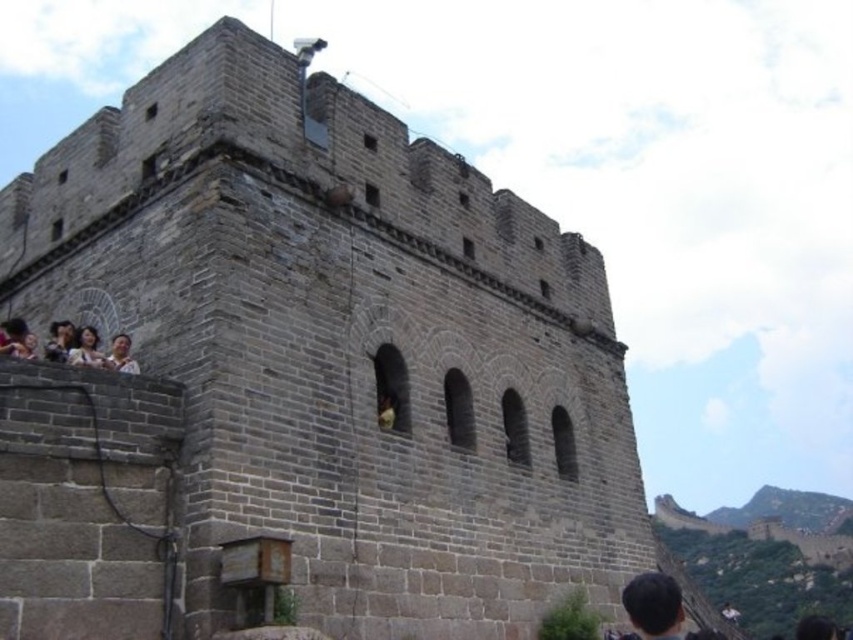
You are a photographer standing at the center of the Great Wall section. You notice a person with matte gray hair at left in the scene. Where would you position your camera to capture their location accurately?

To capture the matte gray hair at left accurately, position your camera at coordinates approximately 0.545 on the x axis and 0.102 on the y axis, as this is where the matte gray hair at left is located.

You are a photographer standing at the base of the Great Wall of China. You notice a point marked at coordinates (86, 348) in the scene. What is the object located at this point?

The point at coordinates (86, 348) indicates matte gray hair at left.

You are standing on the Great Wall of China and notice a light brown wooden chair at left. Where exactly is this chair positioned relative to the wall?

The light brown wooden chair at left is located at point coordinates of 0.533 on the x axis and 0.070 on the y axis.